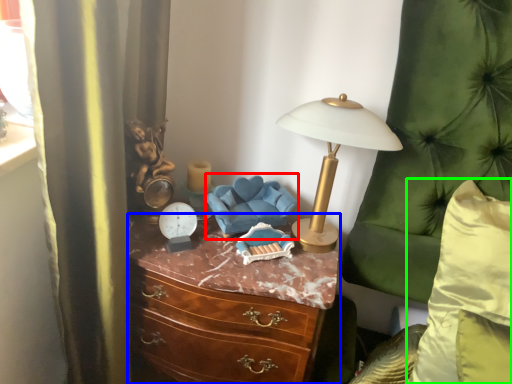
Question: Estimate the real-world distances between objects in this image. Which object is farther from swivel chair (highlighted by a red box), chest of drawers (highlighted by a blue box) or pillow (highlighted by a green box)?

Choices:
 (A) chest of drawers
 (B) pillow

Answer: (B)